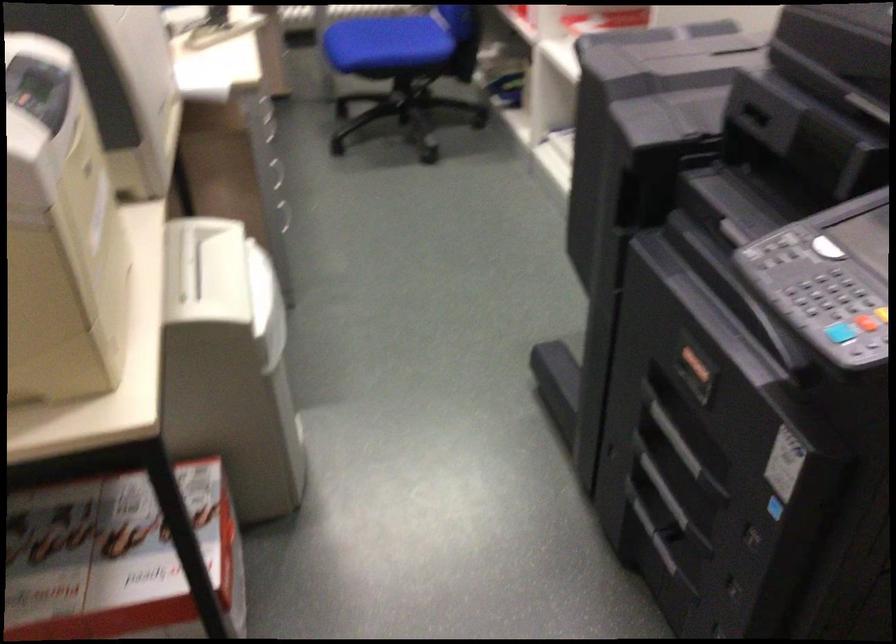
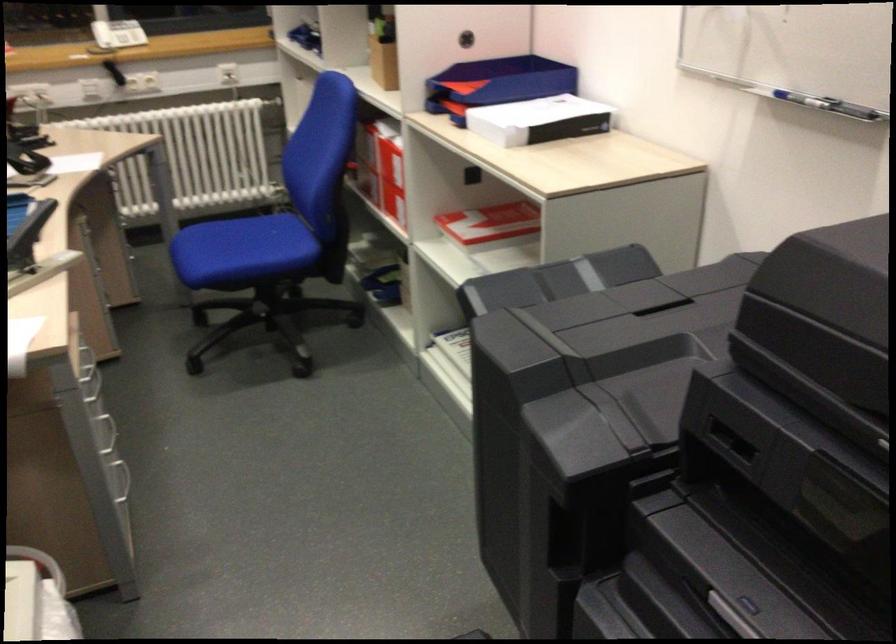
Find the pixel in the second image that matches (282,214) in the first image.

(118, 478)